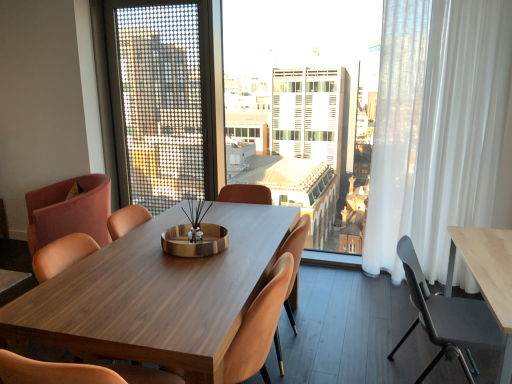
Question: Is transparent curtain at center wider or thinner than wooden chair at center, the second chair viewed from the left?

Choices:
 (A) wide
 (B) thin

Answer: (B)

Question: From a real-world perspective, is transparent curtain at center physically located above or below wooden chair at center, the second chair viewed from the left?

Choices:
 (A) below
 (B) above

Answer: (B)

Question: Which is nearer to the white sheer curtain at right?

Choices:
 (A) matte pink chair at center, the 3th chair from the left
 (B) pink fabric chair at left, positioned as the fifth chair in right-to-left order
 (C) transparent curtain at center
 (D) metallic mesh screen door at upper center
 (E) brown leather chair at center, arranged as the 2th chair when viewed from the right

Answer: (E)

Question: Considering the real-world distances, which object is farthest from the white sheer curtain at right?

Choices:
 (A) brown leather chair at center, which is counted as the fourth chair, starting from the left
 (B) metallic gray chair at right, which is the fifth chair in left-to-right order
 (C) matte pink chair at center, the 3th chair from the left
 (D) metallic mesh screen door at upper center
 (E) wooden chair at center, which is the 4th chair from right to left

Answer: (D)